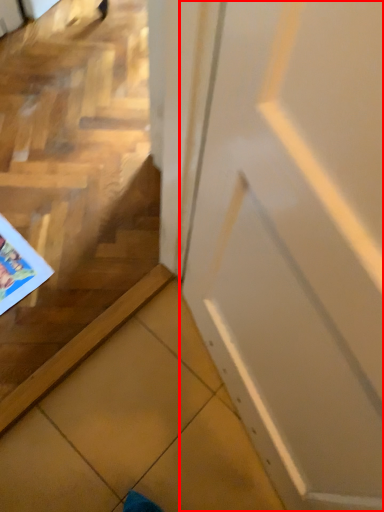
Question: From the image's perspective, where is door (annotated by the red box) located in relation to comic book in the image?

Choices:
 (A) below
 (B) above

Answer: (A)